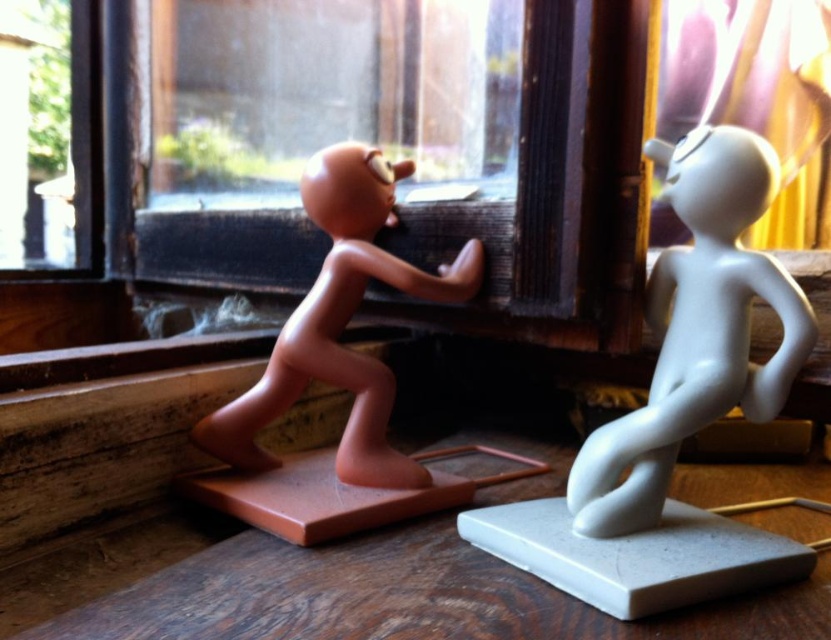
Which of these two, white matte figure at right or matte brown figure at left, stands shorter?

matte brown figure at left is shorter.

Does white matte figure at right appear on the right side of matte brown figure at left?

Correct, you'll find white matte figure at right to the right of matte brown figure at left.

You are a GUI agent. You are given a task and a screenshot of the screen. Output one action in this format:
    pyautogui.click(x=<x>, y=<y>)
    Task: Click on the white matte figure at right
    The image size is (831, 640).
    Given the screenshot: What is the action you would take?
    pyautogui.click(x=696, y=330)